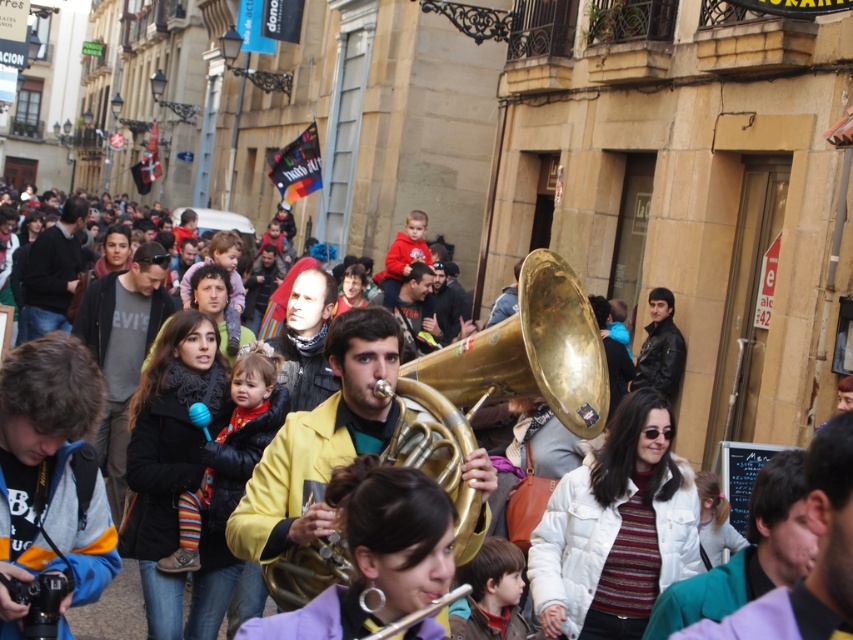
You are a photographer trying to capture a candid shot of the crowd in the street scene. You notice the striped wool sweater at center and the brown hair at center. Which object would you need to frame more broadly in your shot to include its full width?

The striped wool sweater at center has a larger width than the brown hair at center, so you would need to frame the striped wool sweater at center more broadly to include its full width.

You are standing at the origin point of the image. Which direction should you move to reach the striped wool sweater at center?

The striped wool sweater at center is located at point 0.705 in the x and 0.270 in the y coordinates. Since you are at the origin, you should move towards the right and slightly upwards to reach it.